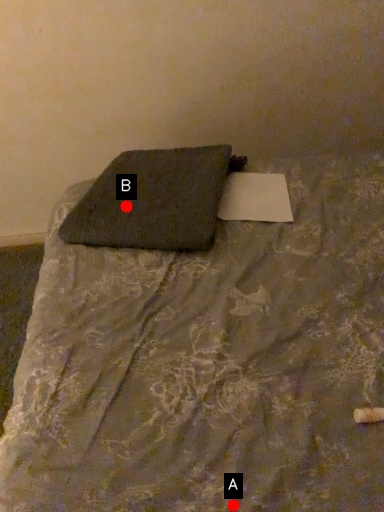
Question: Two points are circled on the image, labeled by A and B beside each circle. Which of the following is the farthest from the observer?

Choices:
 (A) A is further
 (B) B is further

Answer: (B)